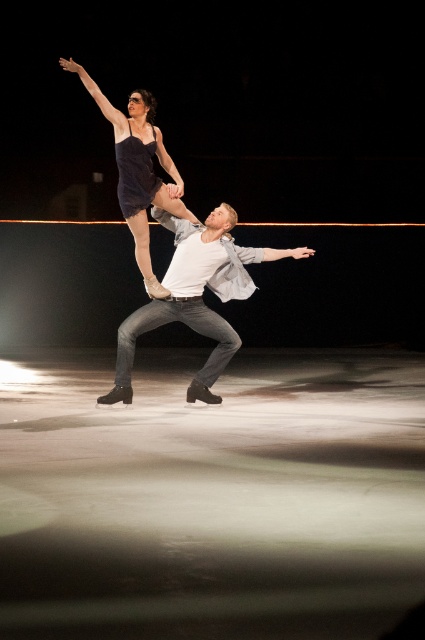
Which is more to the right, white matte shirt at center or matte black leotard at upper center?

Positioned to the right is white matte shirt at center.

Is white matte shirt at center in front of matte black leotard at upper center?

No, white matte shirt at center is behind matte black leotard at upper center.

The width and height of the screenshot is (425, 640). What are the coordinates of `white matte shirt at center` in the screenshot? It's located at (195, 296).

Identify the location of white matte shirt at center. The height and width of the screenshot is (640, 425). (195, 296).